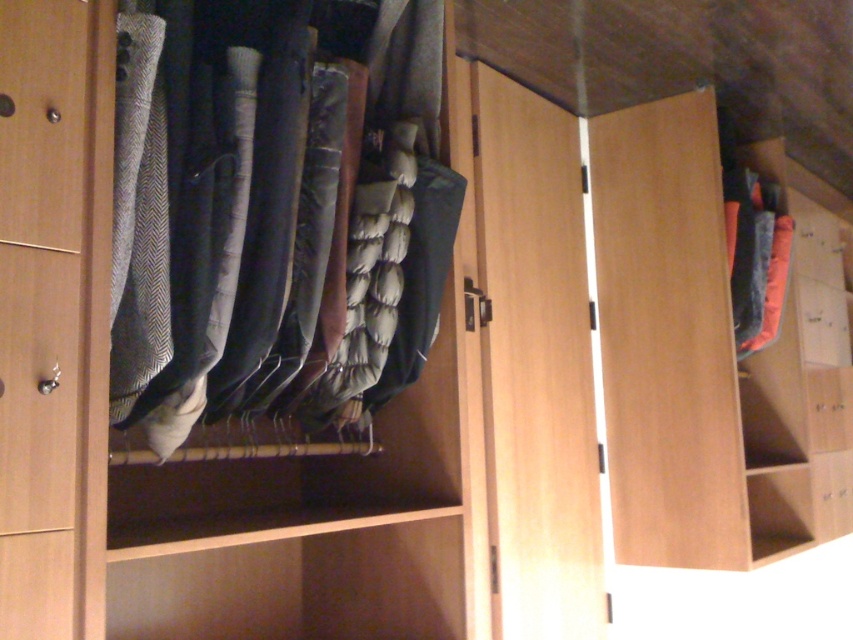
The width and height of the screenshot is (853, 640). In order to click on wooden drawer at center in this screenshot , I will do `click(822, 323)`.

Looking at this image, is wooden drawer at center to the right of wooden drawer at lower right from the viewer's perspective?

Incorrect, wooden drawer at center is not on the right side of wooden drawer at lower right.

Which is behind, point (833, 310) or point (822, 372)?

The point (833, 310) is behind.

Find the location of `wooden drawer at center`. wooden drawer at center is located at coordinates (822, 323).

Can you confirm if wooden shelf at right is bigger than orange fuzzy socks at right?

Yes.

From the picture: Is the position of wooden shelf at right more distant than that of orange fuzzy socks at right?

No, wooden shelf at right is in front of orange fuzzy socks at right.

Between point (647, 211) and point (769, 301), which one is positioned behind?

Point (769, 301)

Locate an element on the screen. The image size is (853, 640). wooden shelf at right is located at coordinates (699, 353).

Is point (612, 417) farther from viewer compared to point (415, 28)?

That is True.

Is wooden shelf at right shorter than dark gray wool pants at center?

No.

Who is more forward, [799,250] or [347,268]?

Point [347,268] is more forward.

At what (x,y) coordinates should I click in order to perform the action: click on wooden shelf at right. Please return your answer as a coordinate pair (x, y). This screenshot has width=853, height=640. Looking at the image, I should click on (699, 353).